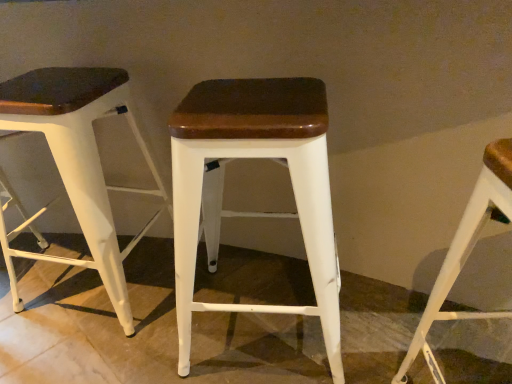
This screenshot has height=384, width=512. I want to click on white matte wood stool at center, which appears as the 2th stool when viewed from the left, so click(253, 158).

This screenshot has height=384, width=512. Identify the location of white matte wood stool at center, which is the first stool from left to right. (77, 164).

Locate an element on the screen. white matte stool at right, which ranks as the 3th stool in left-to-right order is located at coordinates (465, 251).

Based on the photo, can you confirm if white matte wood stool at center, which is the first stool from left to right, is thinner than white matte stool at right, acting as the 1th stool starting from the right?

Incorrect, the width of white matte wood stool at center, which is the first stool from left to right, is not less than that of white matte stool at right, acting as the 1th stool starting from the right.

Is white matte wood stool at center, the 3th stool viewed from the right, facing away from white matte stool at right, acting as the 1th stool starting from the right?

That's not correct — white matte wood stool at center, the 3th stool viewed from the right, is not looking away from white matte stool at right, acting as the 1th stool starting from the right.

Measure the distance from white matte wood stool at center, the 3th stool viewed from the right, to white matte stool at right, acting as the 1th stool starting from the right.

The distance of white matte wood stool at center, the 3th stool viewed from the right, from white matte stool at right, acting as the 1th stool starting from the right, is 89.09 centimeters.

What's the angular difference between white matte stool at right, which ranks as the 3th stool in left-to-right order, and white matte wood stool at center, which appears as the 2th stool when viewed from the left,'s facing directions?

They differ by 6.12 degrees in their facing directions.

Consider the image. Would you say white matte stool at right, acting as the 1th stool starting from the right, is inside or outside white matte wood stool at center, which appears as the 2th stool when viewed from the left?

The correct answer is: outside.

Can you confirm if white matte stool at right, acting as the 1th stool starting from the right, is wider than white matte wood stool at center, which appears as the 2th stool when viewed from the left?

In fact, white matte stool at right, acting as the 1th stool starting from the right, might be narrower than white matte wood stool at center, which appears as the 2th stool when viewed from the left.

From the image's perspective, relative to white matte wood stool at center, arranged as the second stool when viewed from the right, is white matte stool at right, acting as the 1th stool starting from the right, above or below?

Based on their image positions, white matte stool at right, acting as the 1th stool starting from the right, is located beneath white matte wood stool at center, arranged as the second stool when viewed from the right.

Looking at this image, from a real-world perspective, is white matte wood stool at center, which is the first stool from left to right, positioned above or below white matte wood stool at center, which appears as the 2th stool when viewed from the left?

white matte wood stool at center, which is the first stool from left to right, is above white matte wood stool at center, which appears as the 2th stool when viewed from the left.

Looking at this image, would you say white matte wood stool at center, which is the first stool from left to right, is to the left or to the right of white matte wood stool at center, which appears as the 2th stool when viewed from the left, in the picture?

In the image, white matte wood stool at center, which is the first stool from left to right, appears on the left side of white matte wood stool at center, which appears as the 2th stool when viewed from the left.

Where is `stool behind the white matte wood stool at center, which appears as the 2th stool when viewed from the left`? The width and height of the screenshot is (512, 384). stool behind the white matte wood stool at center, which appears as the 2th stool when viewed from the left is located at coordinates (77, 164).

Are white matte wood stool at center, which appears as the 2th stool when viewed from the left, and white matte stool at right, acting as the 1th stool starting from the right, located far from each other?

Actually, white matte wood stool at center, which appears as the 2th stool when viewed from the left, and white matte stool at right, acting as the 1th stool starting from the right, are a little close together.

Does white matte wood stool at center, which appears as the 2th stool when viewed from the left, turn towards white matte stool at right, acting as the 1th stool starting from the right?

No, white matte wood stool at center, which appears as the 2th stool when viewed from the left, is not aimed at white matte stool at right, acting as the 1th stool starting from the right.

Is point (266, 87) positioned after point (510, 313)?

That is False.

Is white matte wood stool at center, which appears as the 2th stool when viewed from the left, shorter than white matte stool at right, acting as the 1th stool starting from the right?

Correct, white matte wood stool at center, which appears as the 2th stool when viewed from the left, is not as tall as white matte stool at right, acting as the 1th stool starting from the right.

Choose the correct answer: Is white matte stool at right, acting as the 1th stool starting from the right, inside white matte wood stool at center, which is the first stool from left to right, or outside it?

white matte stool at right, acting as the 1th stool starting from the right, cannot be found inside white matte wood stool at center, which is the first stool from left to right.

Does white matte stool at right, which ranks as the 3th stool in left-to-right order, appear on the right side of white matte wood stool at center, which is the first stool from left to right?

Yes, white matte stool at right, which ranks as the 3th stool in left-to-right order, is to the right of white matte wood stool at center, which is the first stool from left to right.

Is white matte stool at right, acting as the 1th stool starting from the right, oriented towards white matte wood stool at center, which is the first stool from left to right?

No, white matte stool at right, acting as the 1th stool starting from the right, is not aimed at white matte wood stool at center, which is the first stool from left to right.

Is white matte wood stool at center, arranged as the second stool when viewed from the right, bigger or smaller than white matte wood stool at center, the 3th stool viewed from the right?

Clearly, white matte wood stool at center, arranged as the second stool when viewed from the right, is larger in size than white matte wood stool at center, the 3th stool viewed from the right.

Which object is thinner, white matte wood stool at center, arranged as the second stool when viewed from the right, or white matte wood stool at center, the 3th stool viewed from the right?

Thinner between the two is white matte wood stool at center, the 3th stool viewed from the right.

Is white matte wood stool at center, arranged as the second stool when viewed from the right, oriented towards white matte wood stool at center, the 3th stool viewed from the right?

No, white matte wood stool at center, arranged as the second stool when viewed from the right, is not facing towards white matte wood stool at center, the 3th stool viewed from the right.

Between white matte wood stool at center, arranged as the second stool when viewed from the right, and white matte wood stool at center, the 3th stool viewed from the right, which one is positioned in front?

white matte wood stool at center, arranged as the second stool when viewed from the right, is in front.

Locate an element on the screen. Image resolution: width=512 pixels, height=384 pixels. the 2nd stool below when counting from the white matte wood stool at center, the 3th stool viewed from the right (from the image's perspective) is located at coordinates (465, 251).

From a real-world perspective, which stool is the 2nd one above the white matte wood stool at center, arranged as the second stool when viewed from the right? Please provide its 2D coordinates.

[(465, 251)]

Looking at the image, which one is located closer to white matte wood stool at center, the 3th stool viewed from the right, white matte stool at right, acting as the 1th stool starting from the right, or white matte wood stool at center, arranged as the second stool when viewed from the right?

The object closer to white matte wood stool at center, the 3th stool viewed from the right, is white matte wood stool at center, arranged as the second stool when viewed from the right.

Looking at the image, which one is located further to white matte wood stool at center, which appears as the 2th stool when viewed from the left, white matte wood stool at center, the 3th stool viewed from the right, or white matte stool at right, which ranks as the 3th stool in left-to-right order?

white matte wood stool at center, the 3th stool viewed from the right, is further to white matte wood stool at center, which appears as the 2th stool when viewed from the left.

Looking at the image, which one is located closer to white matte stool at right, acting as the 1th stool starting from the right, white matte wood stool at center, which is the first stool from left to right, or white matte wood stool at center, which appears as the 2th stool when viewed from the left?

white matte wood stool at center, which appears as the 2th stool when viewed from the left, is positioned closer to the anchor white matte stool at right, acting as the 1th stool starting from the right.

Looking at this image, estimate the real-world distances between objects in this image. Which object is closer to white matte wood stool at center, the 3th stool viewed from the right, white matte wood stool at center, which appears as the 2th stool when viewed from the left, or white matte stool at right, acting as the 1th stool starting from the right?

Among the two, white matte wood stool at center, which appears as the 2th stool when viewed from the left, is located nearer to white matte wood stool at center, the 3th stool viewed from the right.

When comparing their distances from white matte stool at right, which ranks as the 3th stool in left-to-right order, does white matte wood stool at center, arranged as the second stool when viewed from the right, or white matte wood stool at center, the 3th stool viewed from the right, seem further?

white matte wood stool at center, the 3th stool viewed from the right, is positioned further to the anchor white matte stool at right, which ranks as the 3th stool in left-to-right order.

Based on their spatial positions, is white matte stool at right, acting as the 1th stool starting from the right, or white matte wood stool at center, the 3th stool viewed from the right, further from white matte wood stool at center, arranged as the second stool when viewed from the right?

The object further to white matte wood stool at center, arranged as the second stool when viewed from the right, is white matte wood stool at center, the 3th stool viewed from the right.

Find the location of `stool located between white matte wood stool at center, which is the first stool from left to right, and white matte stool at right, acting as the 1th stool starting from the right, in the left-right direction`. stool located between white matte wood stool at center, which is the first stool from left to right, and white matte stool at right, acting as the 1th stool starting from the right, in the left-right direction is located at coordinates (253, 158).